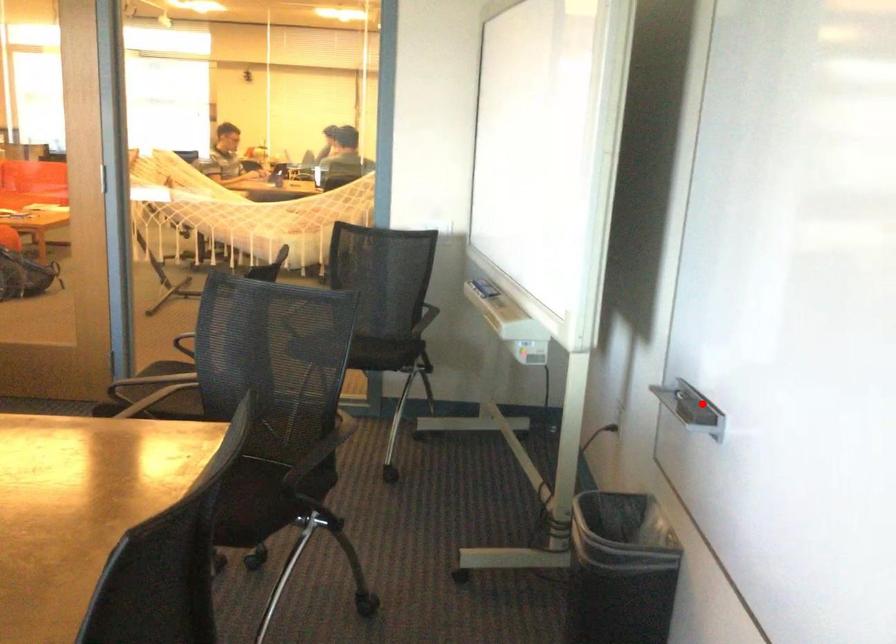
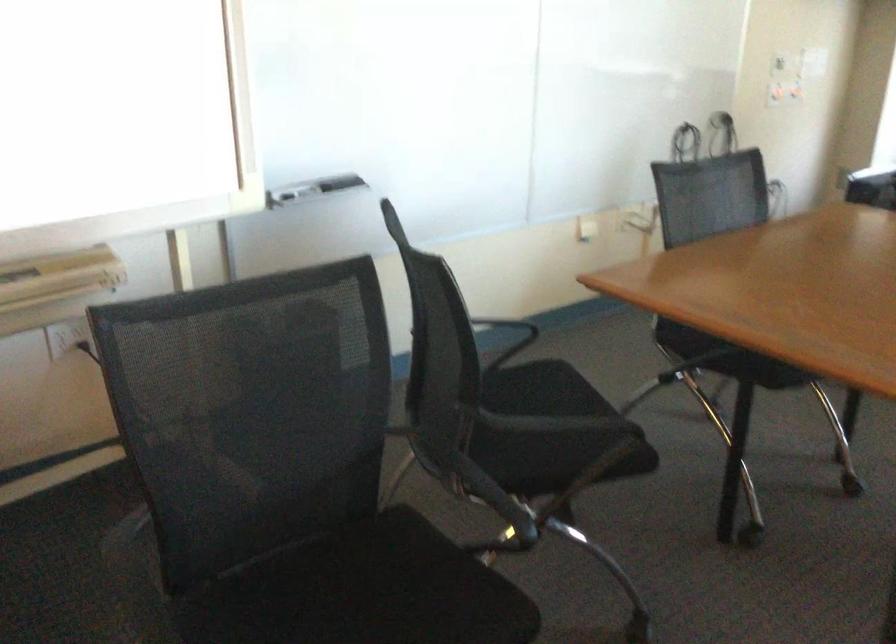
Find the pixel in the second image that matches the highlighted location in the first image.

(312, 189)